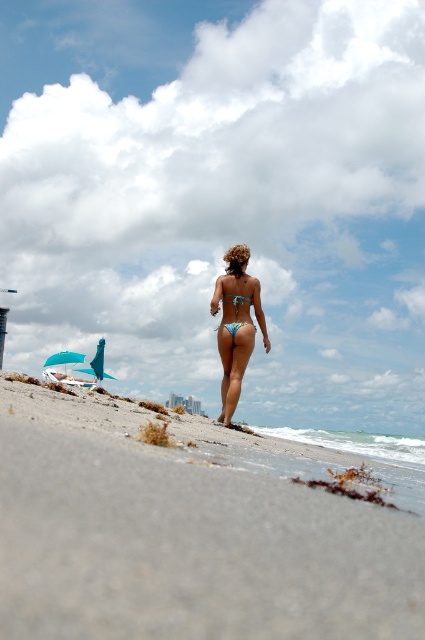
Question: Which is nearer to the blue matte bikini top at center?

Choices:
 (A) blue glossy bikini at center
 (B) blue bikini at center
 (C) gray sand at lower center

Answer: (A)

Question: Which object is farther from the camera taking this photo?

Choices:
 (A) blue bikini at center
 (B) blue glossy bikini at center
 (C) gray sand at lower center

Answer: (B)

Question: Does blue bikini at center have a greater width compared to blue matte bikini top at center?

Choices:
 (A) no
 (B) yes

Answer: (B)

Question: In this image, where is gray sand at lower center located relative to blue bikini at center?

Choices:
 (A) left
 (B) right

Answer: (B)

Question: Can you confirm if gray sand at lower center is wider than blue matte bikini top at center?

Choices:
 (A) no
 (B) yes

Answer: (A)

Question: Which of the following is the farthest from the observer?

Choices:
 (A) gray sand at lower center
 (B) blue glossy bikini at center
 (C) blue matte bikini top at center
 (D) blue bikini at center

Answer: (C)